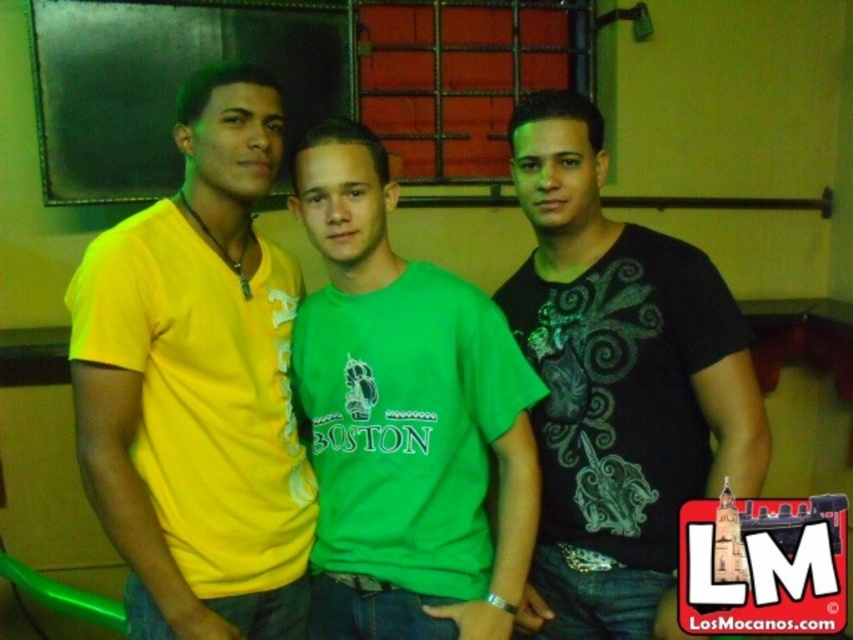
Between point (282, 449) and point (392, 182), which one is positioned in front?

Point (392, 182) is in front.

Where is `yellow matte t-shirt at left`? This screenshot has height=640, width=853. yellow matte t-shirt at left is located at coordinates (198, 384).

Who is more distant from viewer, (567, 147) or (447, 596)?

The point (567, 147) is more distant.

In the scene shown: Which is below, black matte shirt at center or green cotton t-shirt at center?

green cotton t-shirt at center is lower down.

Between point (560, 132) and point (352, 163), which one is positioned in front?

Positioned in front is point (352, 163).

The image size is (853, 640). I want to click on black matte shirt at center, so click(618, 385).

In the scene shown: Is yellow matte t-shirt at left closer to the viewer compared to black matte shirt at center?

Yes, yellow matte t-shirt at left is closer to the viewer.

From the picture: Does yellow matte t-shirt at left appear on the left side of black matte shirt at center?

Correct, you'll find yellow matte t-shirt at left to the left of black matte shirt at center.

Is point (122, 464) positioned after point (732, 301)?

That is False.

This screenshot has width=853, height=640. I want to click on yellow matte t-shirt at left, so click(198, 384).